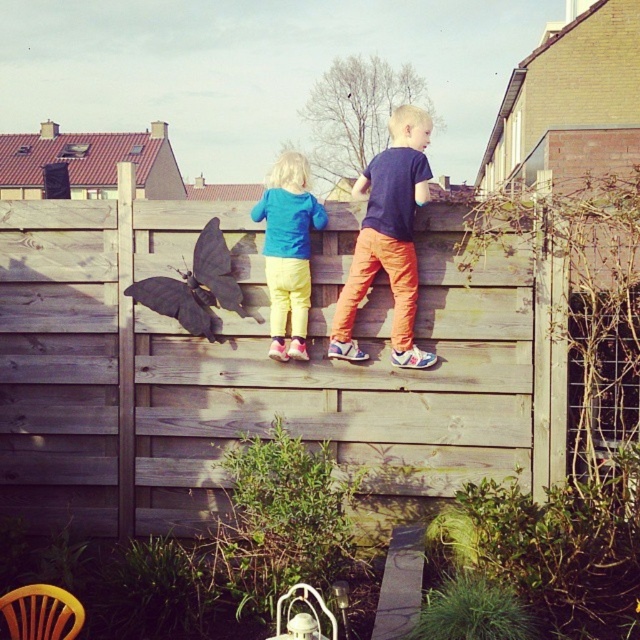
You are standing in the middle of the suburban scene and want to climb onto the wooden fence at center. Based on its position, can you estimate how far to your right or left you need to move to reach it?

The wooden fence at center is located at coordinates point (241, 368), so you need to move to the right since the x coordinate is 0.575 which is to the right of the center point 0.5.

You are a drone operator trying to capture a photo of the wooden fence at center and the matte blue hoodie at upper center. Which object should you focus on first to ensure both are in frame without moving the drone?

You should focus on the wooden fence at center first since it is closer to you than the matte blue hoodie at upper center, ensuring both remain in frame by starting with the closer object.